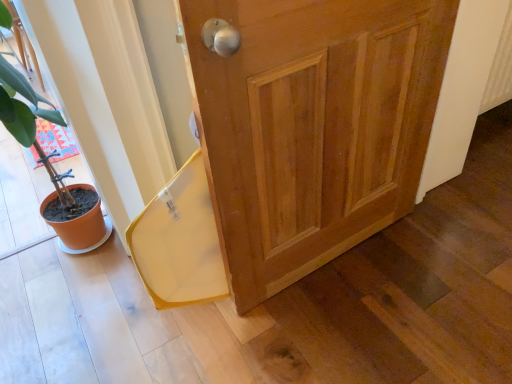
Where is `matte orange pot at left`? The image size is (512, 384). matte orange pot at left is located at coordinates (33, 126).

The height and width of the screenshot is (384, 512). What do you see at coordinates (33, 126) in the screenshot? I see `matte orange pot at left` at bounding box center [33, 126].

Locate an element on the screen. The width and height of the screenshot is (512, 384). matte orange pot at left is located at coordinates [x=33, y=126].